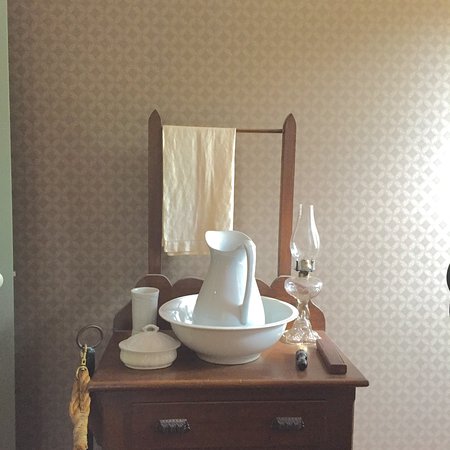
Find the location of a particular element. The width and height of the screenshot is (450, 450). porcelain/ceramic white pitcher is located at coordinates (224, 291).